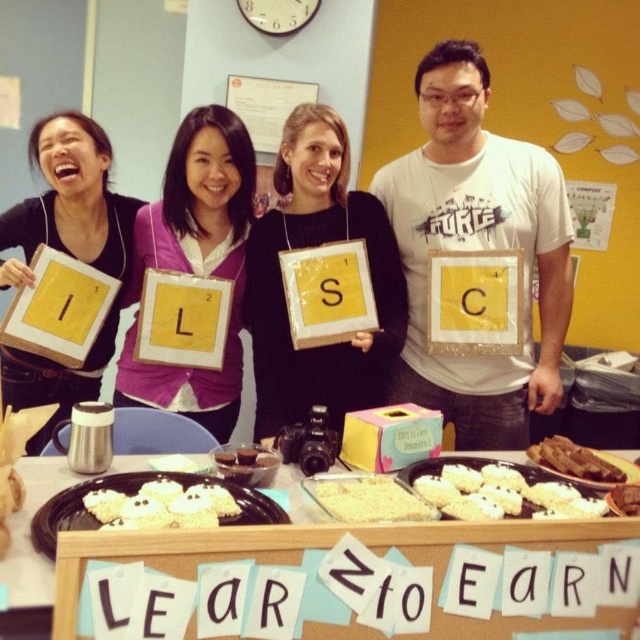
Consider the image. You are a food delivery person who needs to place a hot meal on the table. The meal includes the brown crispy meat at center. However, there is a white cardboard sign at center in the way. Can you slide the sign aside to make space for the meat without moving it more than 30 inches?

The distance between the white cardboard sign at center and brown crispy meat at center is 33.74 inches. Since the required movement exceeds 30 inches, you cannot slide the sign aside within the limit.

Based on the scene description, which baked good is positioned lower on the table between the white rice cake at center and the white crumbly cake at center?

The white rice cake at center is located below the white crumbly cake at center, so it is positioned lower on the table.